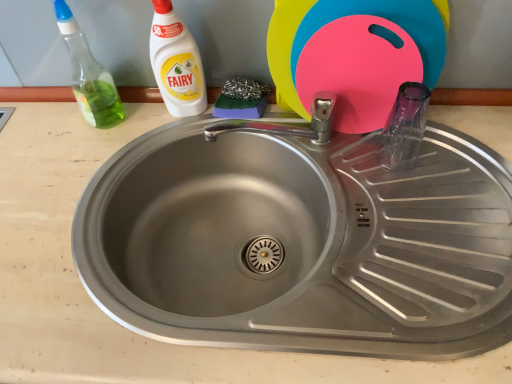
Question: Looking at their shapes, would you say stainless steel sink at center is wider or thinner than white plastic bottle at upper left, placed as the 2th cleaning product when sorted from left to right?

Choices:
 (A) wide
 (B) thin

Answer: (A)

Question: Based on their sizes in the image, would you say stainless steel sink at center is bigger or smaller than white plastic bottle at upper left, placed as the 2th cleaning product when sorted from left to right?

Choices:
 (A) small
 (B) big

Answer: (B)

Question: Which object is the farthest from the transparent glass bottle at right?

Choices:
 (A) white plastic bottle at upper left, which is counted as the 1th cleaning product, starting from the right
 (B) stainless steel sink at center
 (C) green translucent spray bottle at left, which is counted as the first cleaning product, starting from the left
 (D) pink plastic cutting board at upper right

Answer: (C)

Question: Which of these objects is positioned farthest from the green translucent spray bottle at left, marked as the second cleaning product in a right-to-left arrangement?

Choices:
 (A) stainless steel sink at center
 (B) pink plastic cutting board at upper right
 (C) transparent glass bottle at right
 (D) white plastic bottle at upper left, placed as the 2th cleaning product when sorted from left to right

Answer: (C)